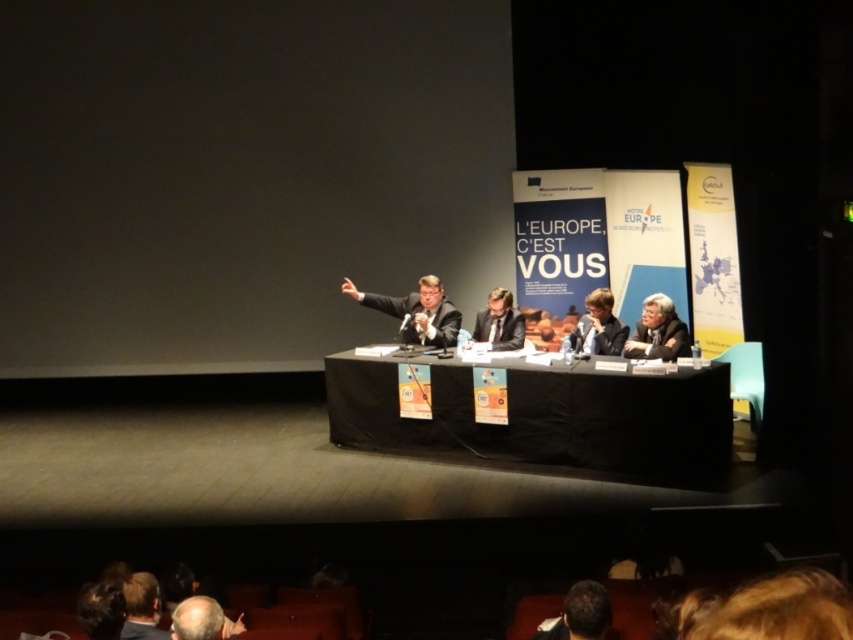
You are sitting in the audience and want to see both the black fabric table at center and the matte black suit at right clearly. Which object will appear larger to you?

The black fabric table at center will appear larger because it is closer to the viewer than the matte black suit at right.

You are standing at the back of the auditorium and want to reach the point marked at coordinates (688, 355) on the stage. If your walking speed is 3 feet per second, how many seconds will it take you to reach that point?

The distance of point (688, 355) from viewer is 22.29 feet. At a speed of 3 feet per second, it would take approximately 7.43 seconds to reach the point.